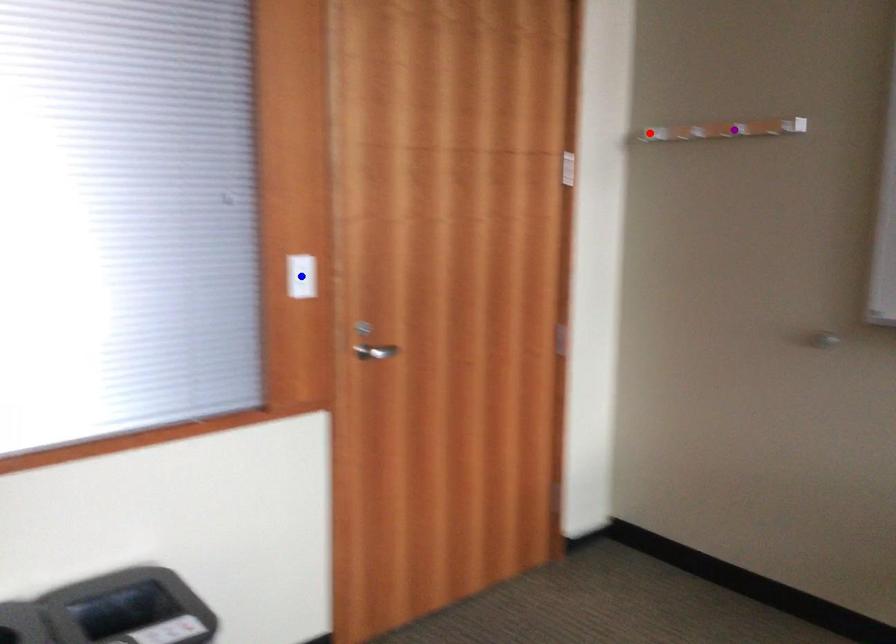
Consider the image. Order these from nearest to farthest:
red point | purple point | blue point

blue point, purple point, red point